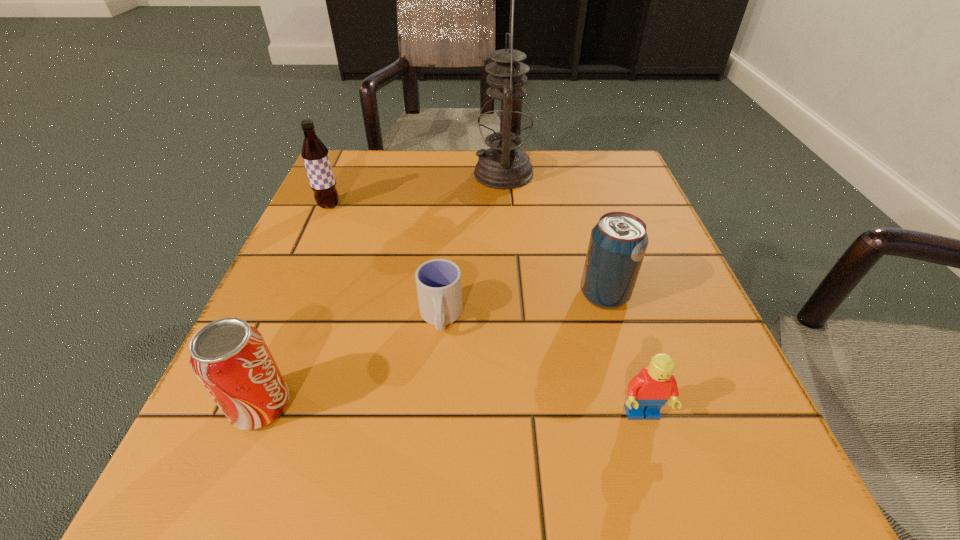
Image resolution: width=960 pixels, height=540 pixels. I want to click on Lego present at the right edge, so click(648, 391).

I want to click on object that is positioned at the far left corner, so click(x=315, y=155).

Locate an element on the screen. The height and width of the screenshot is (540, 960). vacant space at the far edge of the desktop is located at coordinates (548, 187).

I want to click on vacant space at the near edge of the desktop, so click(423, 501).

The height and width of the screenshot is (540, 960). In the image, there is a desktop. In order to click on free space at the left edge in this screenshot , I will do `click(261, 333)`.

You are a GUI agent. You are given a task and a screenshot of the screen. Output one action in this format:
    pyautogui.click(x=<x>, y=<y>)
    Task: Click on the free region at the right edge of the desktop
    
    Given the screenshot: What is the action you would take?
    pyautogui.click(x=666, y=320)

I want to click on vacant area at the far left corner of the desktop, so click(x=367, y=170).

Locate an element on the screen. free space at the near left corner of the desktop is located at coordinates [x=295, y=485].

In the image, there is a desktop. At what (x,y) coordinates should I click in order to perform the action: click on free space at the near right corner. Please return your answer as a coordinate pair (x, y). This screenshot has width=960, height=540. Looking at the image, I should click on (738, 459).

I want to click on vacant region between the nearer soda can and the Lego, so click(451, 410).